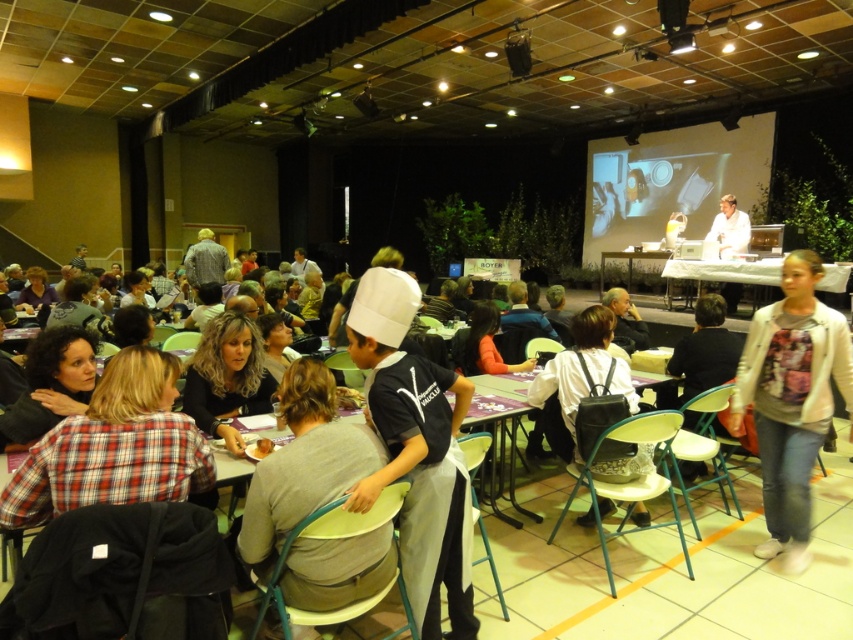
Between plaid fabric shirt at lower left and white cotton jacket at lower right, which one appears on the right side from the viewer's perspective?

white cotton jacket at lower right

Is point (149, 394) farther from camera compared to point (791, 314)?

No.

The height and width of the screenshot is (640, 853). Find the location of `plaid fabric shirt at lower left`. plaid fabric shirt at lower left is located at coordinates (114, 445).

Does gray fabric shirt at center have a greater width compared to matte white projector screen at upper right?

No.

Is gray fabric shirt at center closer to camera compared to matte white projector screen at upper right?

That is True.

Measure the distance between gray fabric shirt at center and camera.

A distance of 1.71 meters exists between gray fabric shirt at center and camera.

Locate an element on the screen. Image resolution: width=853 pixels, height=640 pixels. gray fabric shirt at center is located at coordinates (303, 464).

How much distance is there between white cotton jacket at lower right and curly hair at lower left?

white cotton jacket at lower right is 2.74 meters from curly hair at lower left.

Is white cotton jacket at lower right below curly hair at lower left?

Correct, white cotton jacket at lower right is located below curly hair at lower left.

The image size is (853, 640). Find the location of `white cotton jacket at lower right`. white cotton jacket at lower right is located at coordinates (791, 400).

Locate an element on the screen. Image resolution: width=853 pixels, height=640 pixels. white cotton jacket at lower right is located at coordinates (791, 400).